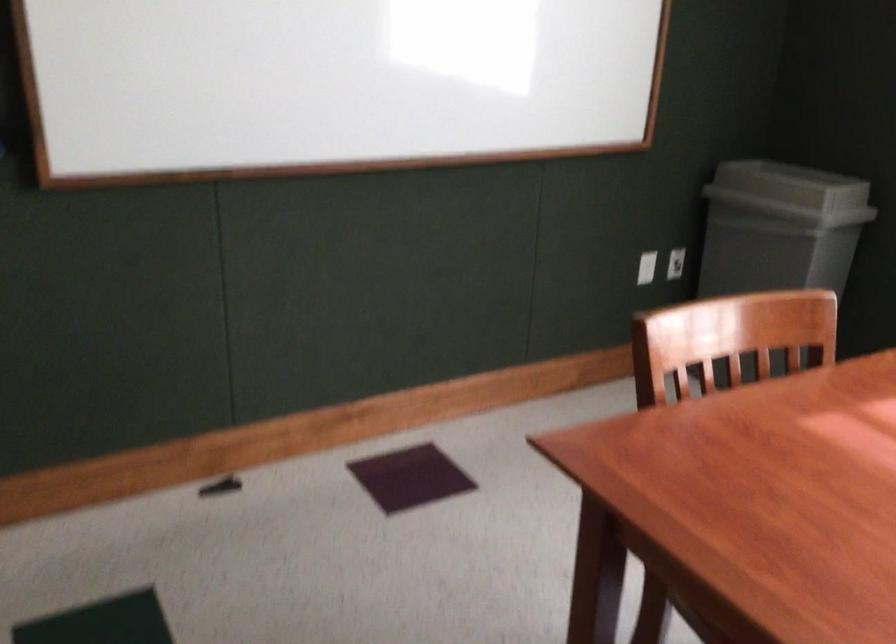
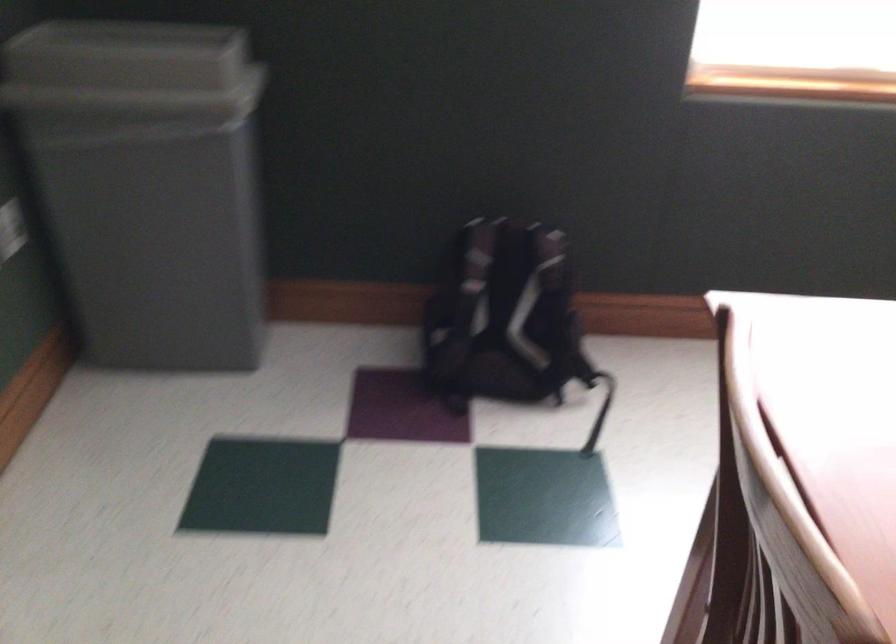
Where in the second image is the point corresponding to the point at 765,182 from the first image?

(131, 71)